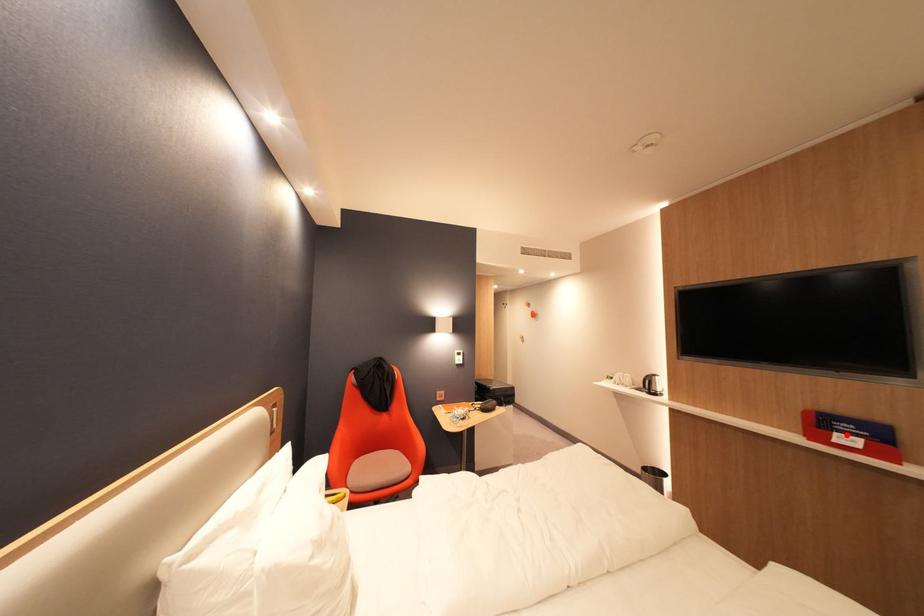
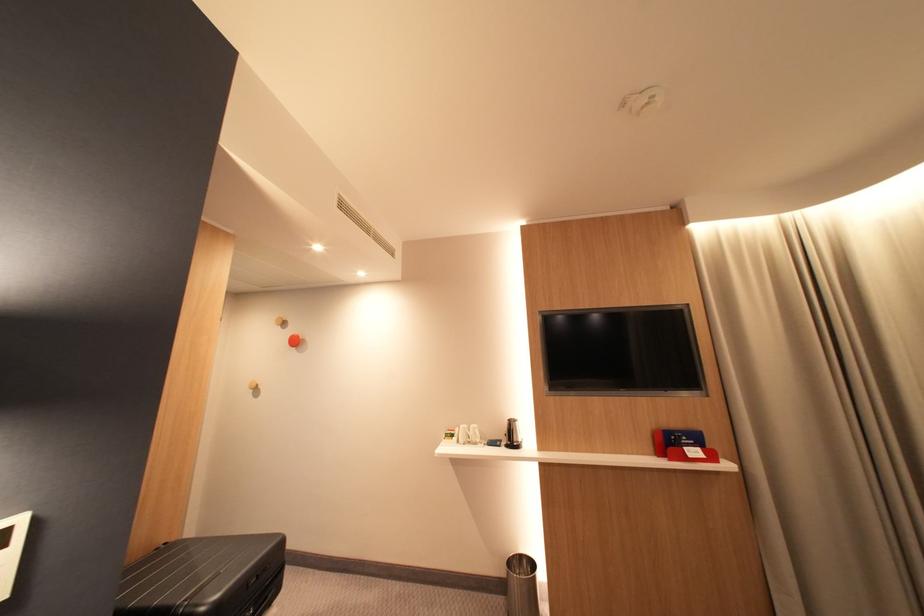
Question: I am providing you with two images of the same scene from different viewpoints. Given a red point in image1, look at the same physical point in image2. Is it:

Choices:
 (A) Closer to the viewpoint
 (B) Farther from the viewpoint

Answer: (B)